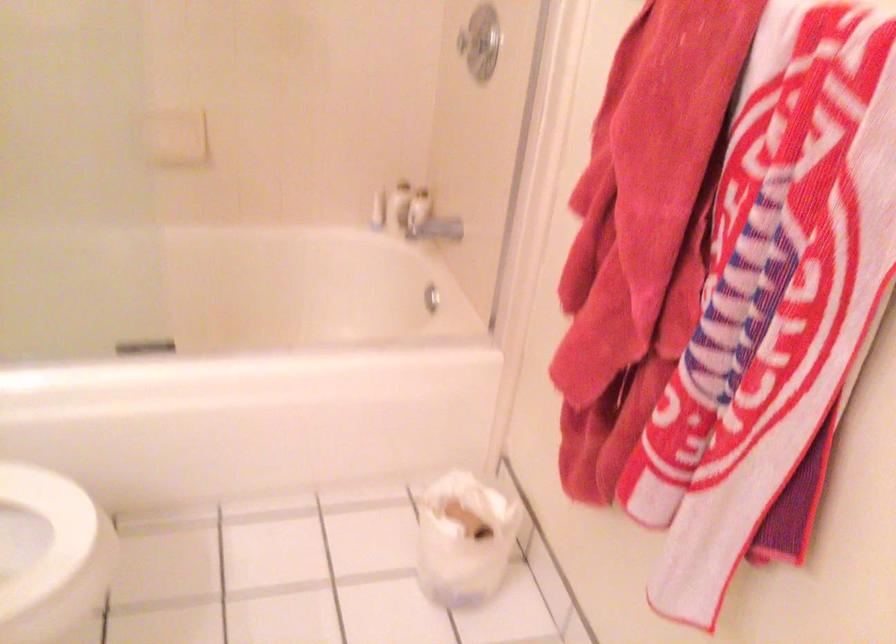
Locate an element on the screen. Image resolution: width=896 pixels, height=644 pixels. silver shower knob is located at coordinates (478, 42).